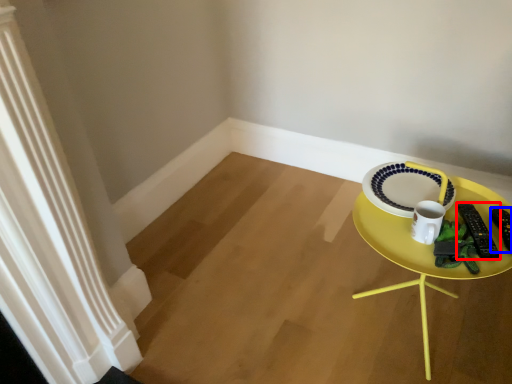
Question: Which point is further to the camera, remote control (highlighted by a red box) or remote control (highlighted by a blue box)?

Choices:
 (A) remote control
 (B) remote control

Answer: (B)